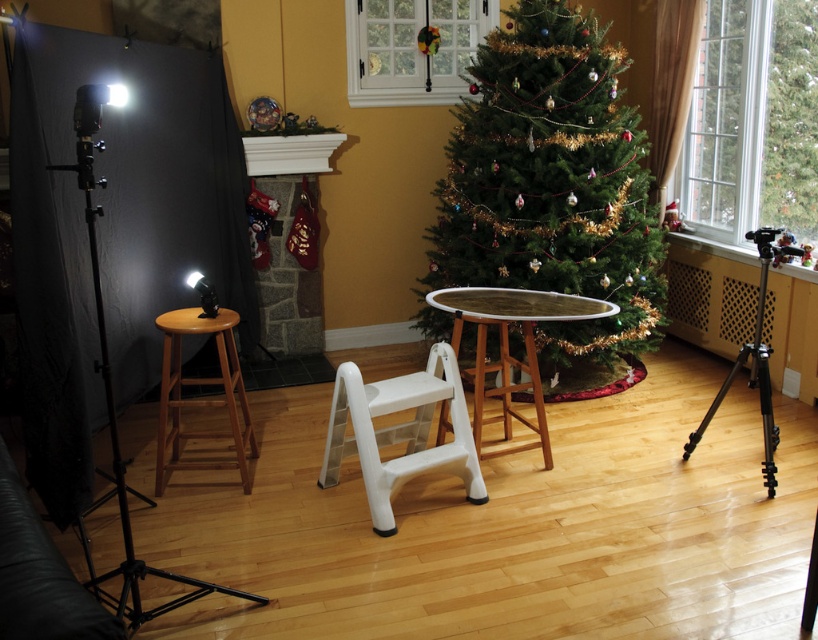
Consider the image. Does black metal tripod at left have a greater width compared to wooden stool at center-left?

Yes, black metal tripod at left is wider than wooden stool at center-left.

Which is behind, point (138, 561) or point (176, 321)?

Point (176, 321)

Identify the location of black metal tripod at left. (115, 428).

Identify the location of green textured christmas tree at center. Image resolution: width=818 pixels, height=640 pixels. (551, 186).

Is green textured christmas tree at center above black metal tripod at left?

Yes, green textured christmas tree at center is above black metal tripod at left.

Between point (628, 173) and point (210, 314), which one is positioned behind?

Point (628, 173)

You are a GUI agent. You are given a task and a screenshot of the screen. Output one action in this format:
    pyautogui.click(x=<x>, y=<y>)
    Task: Click on the green textured christmas tree at center
    This screenshot has height=640, width=818.
    Given the screenshot: What is the action you would take?
    pyautogui.click(x=551, y=186)

Does wooden stool at center-left appear over black metal tripod at lower right?

No.

Image resolution: width=818 pixels, height=640 pixels. I want to click on wooden stool at center-left, so click(200, 397).

Locate an element on the screen. wooden stool at center-left is located at coordinates (200, 397).